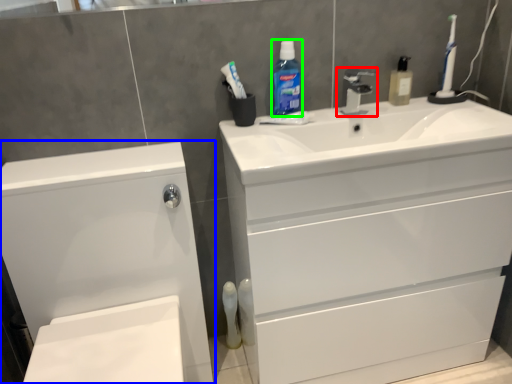
Question: Estimate the real-world distances between objects in this image. Which object is farther from tap (highlighted by a red box), bathroom cabinet (highlighted by a blue box) or cleaning product (highlighted by a green box)?

Choices:
 (A) bathroom cabinet
 (B) cleaning product

Answer: (A)